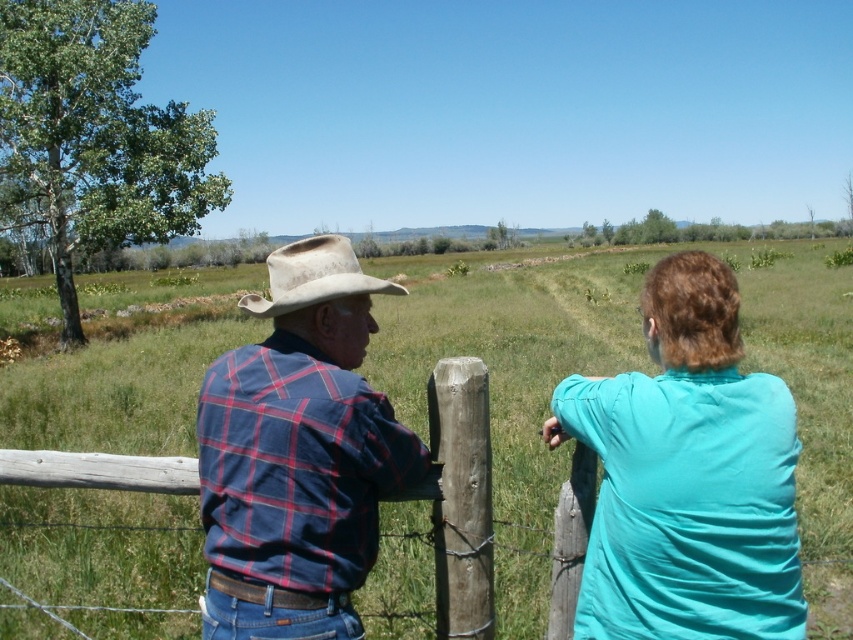
You are a photographer positioned at the edge of the grassy field and want to capture both individuals in your shot. Which point, point [601,611] or point [740,376], is closer to you?

Point [601,611] is closer to you because it is further to the viewer than point [740,376].

Based on the scene description, where is the plaid fabric shirt at left located in the image?

The plaid fabric shirt at left is located at point [688,476].

In the scene shown: You are a photographer trying to capture a clear shot of both the plaid cotton shirt at center and the worn beige fabric cowboy hat at upper center. Since you want both items to be visible in the frame, does the height difference between them pose a problem?

The plaid cotton shirt at center is taller than the worn beige fabric cowboy hat at upper center, so the height difference should not be a problem as both can be captured within the frame.